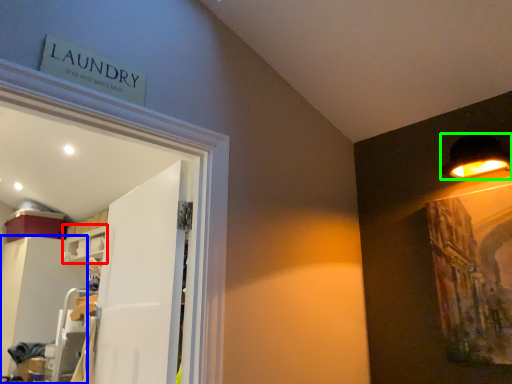
Question: Considering the real-world distances, which object is closest to shelf (highlighted by a red box)? cabinetry (highlighted by a blue box) or lamp (highlighted by a green box).

Choices:
 (A) cabinetry
 (B) lamp

Answer: (A)